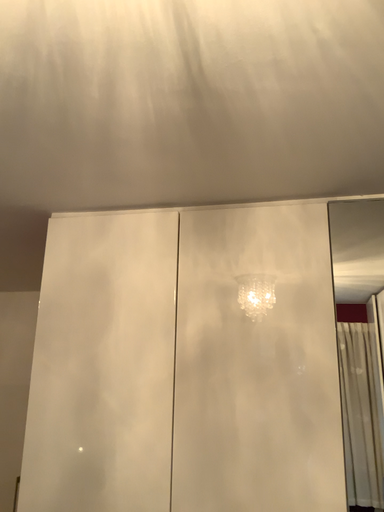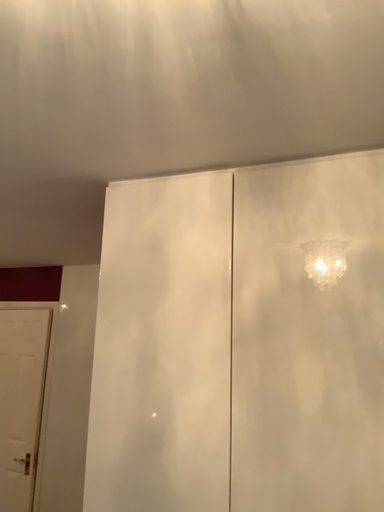
Question: Which way did the camera rotate in the video?

Choices:
 (A) rotated right
 (B) rotated left

Answer: (B)